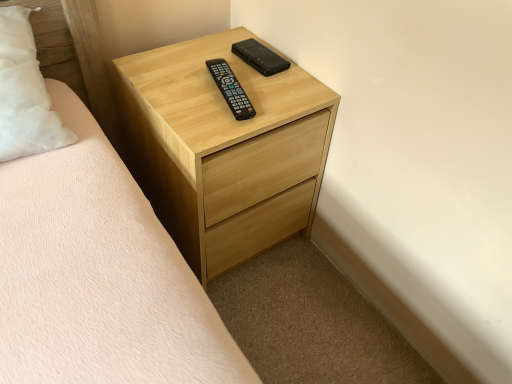
Locate an element on the screen. Image resolution: width=512 pixels, height=384 pixels. spots to the right of black plastic remote at center, the first control from the front is located at coordinates (284, 99).